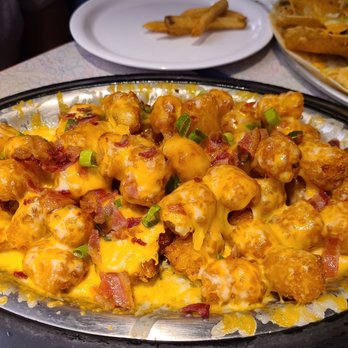
Where is `white plate`? white plate is located at coordinates (222, 58).